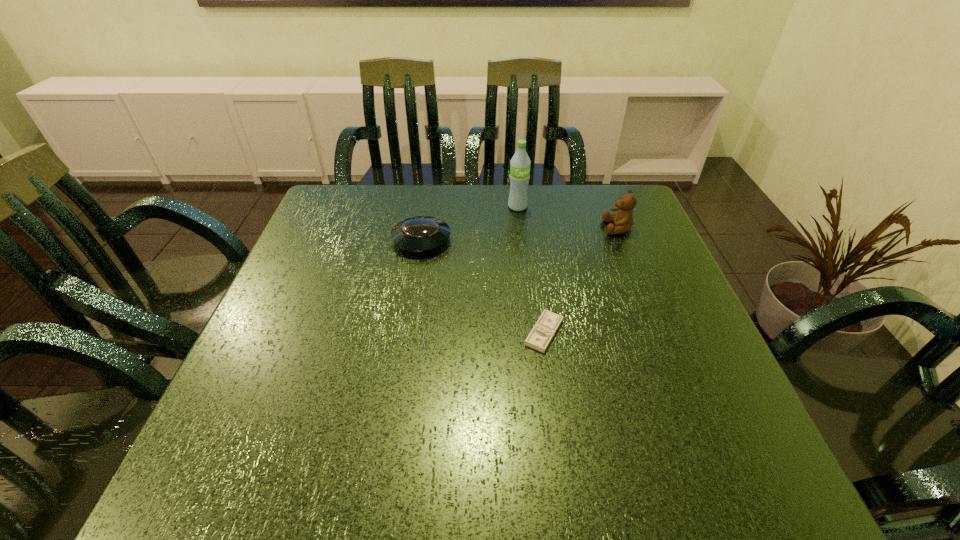
Find the location of `free space that is in between the leftmost object and the nearest object`. free space that is in between the leftmost object and the nearest object is located at coordinates (483, 286).

I want to click on unoccupied position between the money and the farthest object, so click(531, 269).

This screenshot has width=960, height=540. I want to click on vacant area that lies between the farthest object and the teddy bear, so click(x=568, y=217).

You are a GUI agent. You are given a task and a screenshot of the screen. Output one action in this format:
    pyautogui.click(x=<x>, y=<y>)
    Task: Click on the free space between the farthest object and the third tallest object
    This screenshot has width=960, height=540.
    Given the screenshot: What is the action you would take?
    pyautogui.click(x=469, y=223)

At what (x,y) coordinates should I click in order to perform the action: click on vacant space in between the rightmost object and the saucer. Please return your answer as a coordinate pair (x, y). Looking at the image, I should click on (x=520, y=234).

I want to click on empty space that is in between the rightmost object and the leftmost object, so click(x=520, y=234).

Identify which object is the third closest to the second shortest object. Please provide its 2D coordinates. Your answer should be formatted as a tuple, i.e. [(x, y)], where the tuple contains the x and y coordinates of a point satisfying the conditions above.

[(623, 220)]

Identify the location of the closest object to the second tallest object. (520, 163).